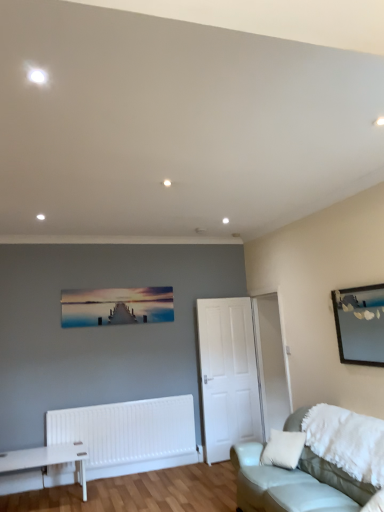
Question: Is matte wooden pier at center, placed as the 1th picture frame when sorted from left to right, positioned with its back to leather couch at lower right?

Choices:
 (A) yes
 (B) no

Answer: (B)

Question: Does matte wooden pier at center, placed as the 1th picture frame when sorted from left to right, have a lesser height compared to leather couch at lower right?

Choices:
 (A) yes
 (B) no

Answer: (A)

Question: Is matte wooden pier at center, placed as the 1th picture frame when sorted from back to front, not close to leather couch at lower right?

Choices:
 (A) no
 (B) yes

Answer: (B)

Question: Can you confirm if matte wooden pier at center, placed as the 1th picture frame when sorted from left to right, is positioned to the right of leather couch at lower right?

Choices:
 (A) yes
 (B) no

Answer: (B)

Question: Does matte wooden pier at center, placed as the 1th picture frame when sorted from back to front, lie behind leather couch at lower right?

Choices:
 (A) no
 (B) yes

Answer: (B)

Question: Is matte wooden pier at center, placed as the 1th picture frame when sorted from back to front, aimed at leather couch at lower right?

Choices:
 (A) no
 (B) yes

Answer: (A)

Question: From a real-world perspective, is white matte door at center physically below wooden mirror at upper right, the second picture frame from the left?

Choices:
 (A) no
 (B) yes

Answer: (B)

Question: Would you say white matte door at center contains wooden mirror at upper right, the first picture frame positioned from the right?

Choices:
 (A) yes
 (B) no

Answer: (B)

Question: Does white matte door at center have a larger size compared to wooden mirror at upper right, the second picture frame from the left?

Choices:
 (A) no
 (B) yes

Answer: (B)

Question: Is white matte door at center taller than wooden mirror at upper right, arranged as the first picture frame when viewed from the front?

Choices:
 (A) yes
 (B) no

Answer: (A)

Question: Can you confirm if white matte door at center is shorter than wooden mirror at upper right, the second picture frame from the left?

Choices:
 (A) no
 (B) yes

Answer: (A)

Question: From the image's perspective, is white matte door at center located above wooden mirror at upper right, the 2th picture frame from the back?

Choices:
 (A) yes
 (B) no

Answer: (B)

Question: Considering the relative sizes of wooden mirror at upper right, arranged as the first picture frame when viewed from the front, and white matte door at center in the image provided, is wooden mirror at upper right, arranged as the first picture frame when viewed from the front, taller than white matte door at center?

Choices:
 (A) no
 (B) yes

Answer: (A)